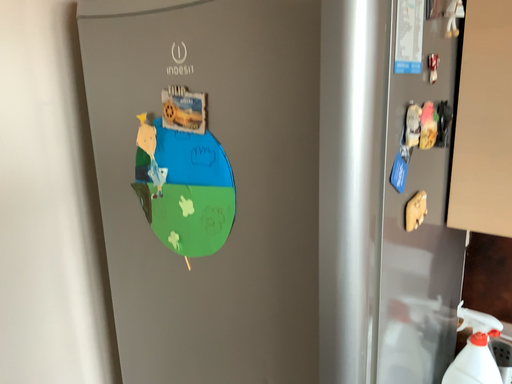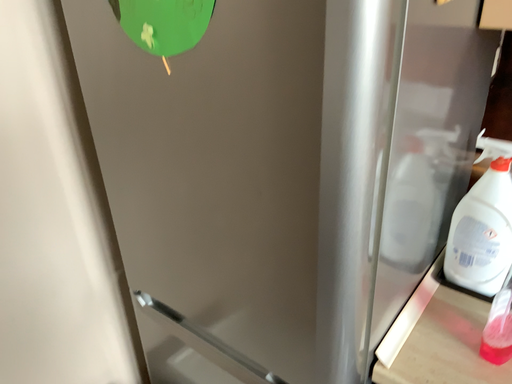
Question: Which way did the camera rotate in the video?

Choices:
 (A) rotated upward
 (B) rotated downward

Answer: (B)